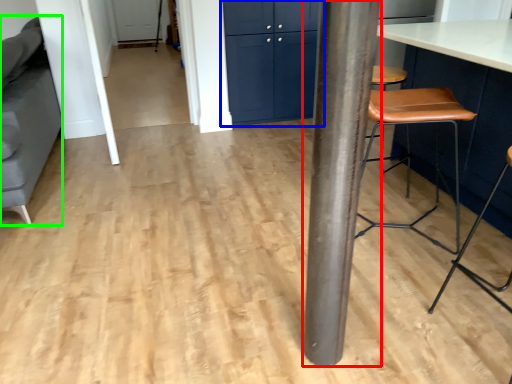
Question: Considering the real-world distances, which object is farthest from pillar (highlighted by a red box)? cabinetry (highlighted by a blue box) or swivel chair (highlighted by a green box)?

Choices:
 (A) cabinetry
 (B) swivel chair

Answer: (A)